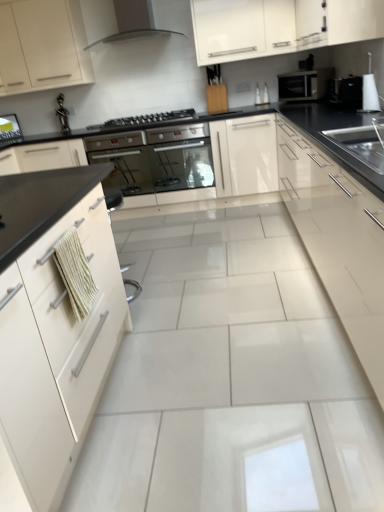
Question: From the image's perspective, relative to matte black range hood at upper center, is white glossy cabinet at left, placed as the 2th cabinetry when sorted from left to right, above or below?

Choices:
 (A) below
 (B) above

Answer: (A)

Question: Is white glossy cabinet at left, the 3th cabinetry viewed from the right, wider or thinner than matte black range hood at upper center?

Choices:
 (A) wide
 (B) thin

Answer: (A)

Question: Considering the real-world distances, which object is closest to the black glossy microwave at upper right, which appears as the 1th appliance when viewed from the back?

Choices:
 (A) glossy cream cabinet at right, the first cabinetry in the right-to-left sequence
 (B) white glossy cabinet at upper center, the 2th cabinetry when ordered from right to left
 (C) stainless steel oven at center, the 2th oven when ordered from right to left
 (D) white glossy cabinet at left, placed as the 2th cabinetry when sorted from left to right
 (E) satin black oven at center, which is counted as the second oven, starting from the left

Answer: (A)

Question: Which object is positioned farthest from the white glossy cabinet at left, the 3th cabinetry viewed from the right?

Choices:
 (A) white glossy cabinet at upper center, the 2th cabinetry when ordered from right to left
 (B) black glass gas stove at center
 (C) metallic figurine at upper left
 (D) white glossy cabinet at upper left, acting as the 4th cabinetry starting from the right
 (E) black glossy microwave at upper right, which is the 2th appliance in front-to-back order

Answer: (C)